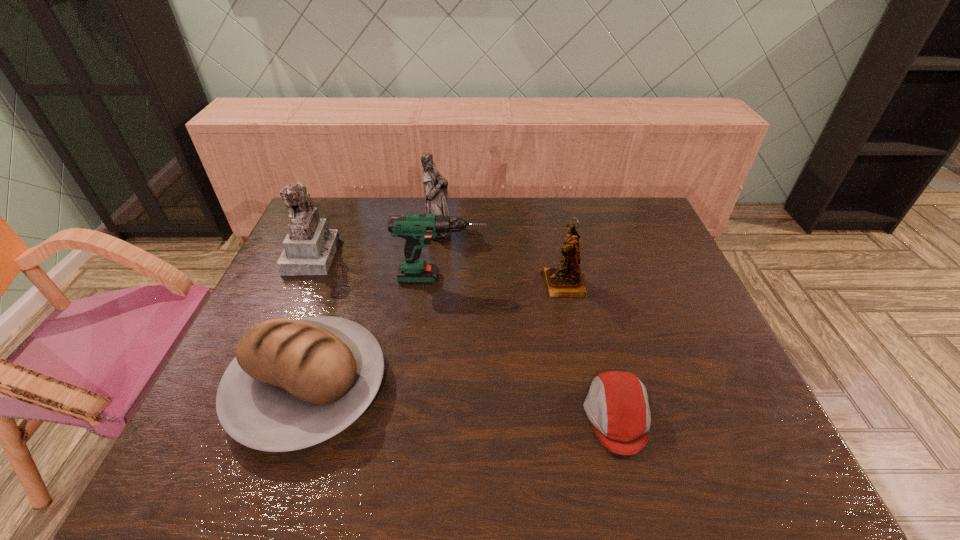
Locate an element on the screen. object that is at the far left corner is located at coordinates (309, 247).

Identify the location of object that is at the near left corner. This screenshot has height=540, width=960. (293, 384).

Identify the location of blank space at the far edge. (471, 214).

Find the location of a particular element. The width and height of the screenshot is (960, 540). free space at the near edge of the desktop is located at coordinates (288, 478).

Find the location of a particular element. The height and width of the screenshot is (540, 960). blank space at the far left corner of the desktop is located at coordinates pyautogui.click(x=332, y=198).

Locate an element on the screen. free space at the far right corner is located at coordinates (630, 236).

Where is `free point between the bread and the second figurine from right to left`? The width and height of the screenshot is (960, 540). free point between the bread and the second figurine from right to left is located at coordinates (372, 308).

In order to click on free space between the cap and the second shortest object in this screenshot , I will do `click(463, 402)`.

Locate an element on the screen. The height and width of the screenshot is (540, 960). free point between the shortest object and the second figurine from right to left is located at coordinates (527, 322).

Identify the location of free space between the shortest figurine and the drill. (502, 281).